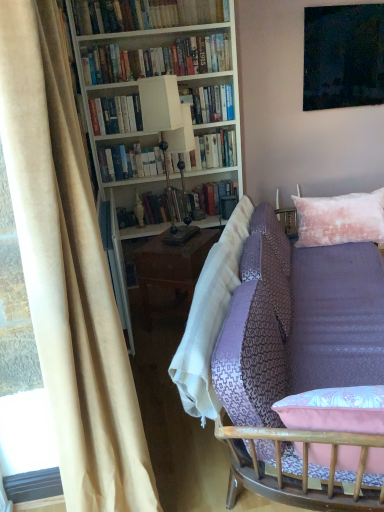
This screenshot has height=512, width=384. I want to click on free space above hardcover book at upper center, the third book from the top (from a real-world perspective), so click(x=207, y=83).